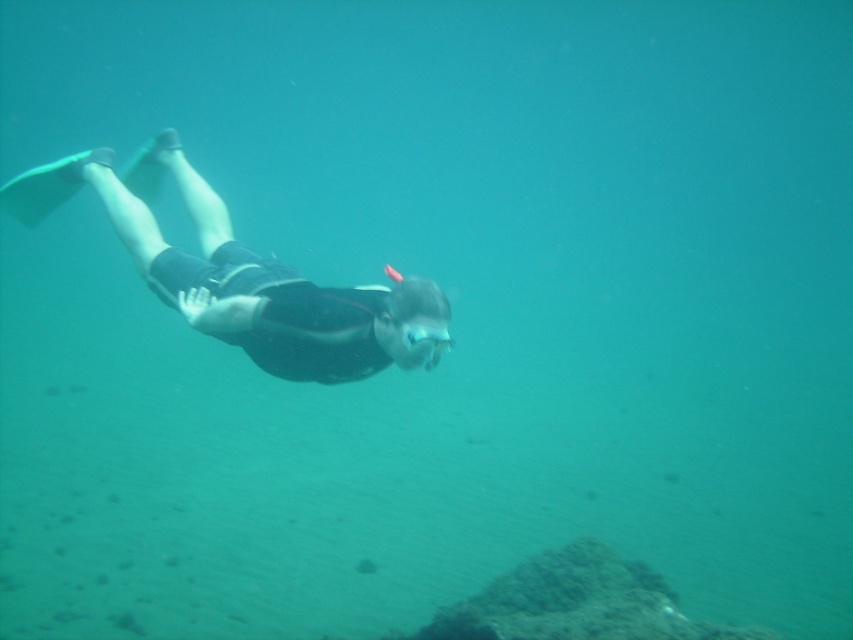
This screenshot has width=853, height=640. What do you see at coordinates (235, 273) in the screenshot?
I see `black matte wetsuit at center` at bounding box center [235, 273].

Which is below, black matte wetsuit at center or clear plastic goggles at center?

Positioned lower is clear plastic goggles at center.

Who is more distant from viewer, (178, 272) or (403, 323)?

The point (178, 272) is more distant.

Where is `black matte wetsuit at center`? This screenshot has height=640, width=853. black matte wetsuit at center is located at coordinates (235, 273).